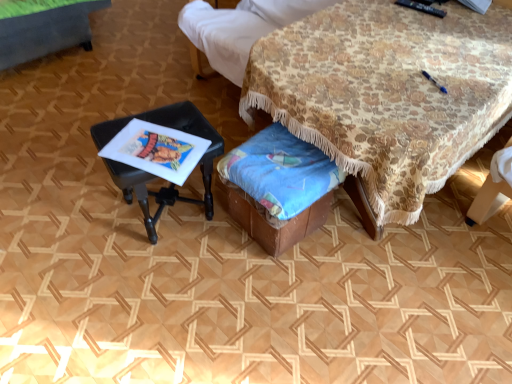
Question: Is floral fabric table at center, the 1th table from the right, behind blue fabric at lower center?

Choices:
 (A) yes
 (B) no

Answer: (B)

Question: Does floral fabric table at center, the 1th table from the right, appear on the left side of blue fabric at lower center?

Choices:
 (A) no
 (B) yes

Answer: (A)

Question: Does floral fabric table at center, marked as the 2th table in a left-to-right arrangement, touch blue fabric at lower center?

Choices:
 (A) yes
 (B) no

Answer: (B)

Question: Is floral fabric table at center, the 1th table from the right, in front of blue fabric at lower center?

Choices:
 (A) no
 (B) yes

Answer: (B)

Question: Can you confirm if floral fabric table at center, the 1th table from the right, is bigger than blue fabric at lower center?

Choices:
 (A) yes
 (B) no

Answer: (A)

Question: Is black plastic stool at left, arranged as the 1th table when viewed from the left, wider or thinner than floral fabric table at center, marked as the 2th table in a left-to-right arrangement?

Choices:
 (A) wide
 (B) thin

Answer: (B)

Question: From their relative heights in the image, would you say black plastic stool at left, arranged as the 1th table when viewed from the left, is taller or shorter than floral fabric table at center, the 1th table from the right?

Choices:
 (A) tall
 (B) short

Answer: (B)

Question: Do you think black plastic stool at left, arranged as the 1th table when viewed from the left, is within floral fabric table at center, the 1th table from the right, or outside of it?

Choices:
 (A) inside
 (B) outside

Answer: (B)

Question: Visually, is black plastic stool at left, arranged as the 1th table when viewed from the left, positioned to the left or to the right of floral fabric table at center, marked as the 2th table in a left-to-right arrangement?

Choices:
 (A) left
 (B) right

Answer: (A)

Question: Is point (454, 64) closer or farther from the camera than point (158, 216)?

Choices:
 (A) closer
 (B) farther

Answer: (A)

Question: Is floral fabric table at center, marked as the 2th table in a left-to-right arrangement, inside or outside of black plastic stool at left, arranged as the 1th table when viewed from the left?

Choices:
 (A) outside
 (B) inside

Answer: (A)

Question: In terms of height, does floral fabric table at center, marked as the 2th table in a left-to-right arrangement, look taller or shorter compared to black plastic stool at left, arranged as the 1th table when viewed from the left?

Choices:
 (A) short
 (B) tall

Answer: (B)

Question: Considering their positions, is floral fabric table at center, the 1th table from the right, located in front of or behind black plastic stool at left, placed as the 2th table when sorted from right to left?

Choices:
 (A) front
 (B) behind

Answer: (A)

Question: Is point (475, 31) positioned closer to the camera than point (242, 188)?

Choices:
 (A) farther
 (B) closer

Answer: (A)

Question: Is floral fabric table at center, marked as the 2th table in a left-to-right arrangement, bigger or smaller than blue fabric at lower center?

Choices:
 (A) small
 (B) big

Answer: (B)